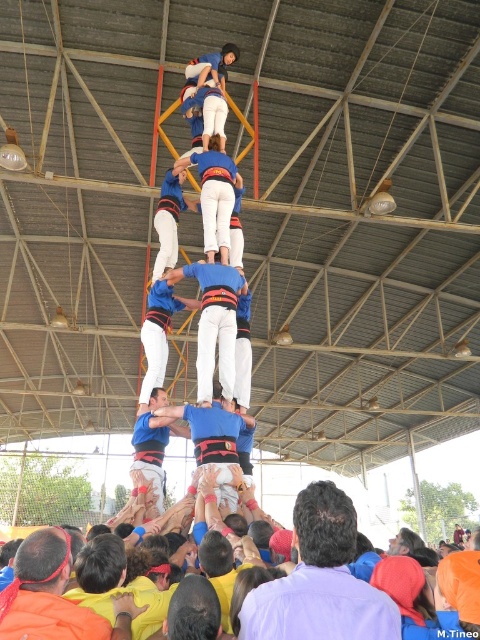
You are a photographer positioned at the front of the human tower. You notice the purple shirt at center and the blue fabric pants at center in your viewfinder. Which object is closer to you?

The purple shirt at center is in front of the blue fabric pants at center, so the purple shirt at center is closer to you.

You are a photographer positioned at the base of the human tower. You notice the purple shirt at center and the blue fabric pants at center in your view. Which object is closer to you?

The purple shirt at center is closer to you because it is located below the blue fabric pants at center.